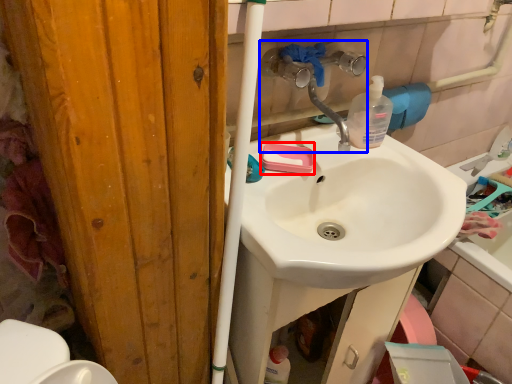
Question: Which of the following is the farthest to the observer, soap (highlighted by a red box) or plumbing fixture (highlighted by a blue box)?

Choices:
 (A) soap
 (B) plumbing fixture

Answer: (A)